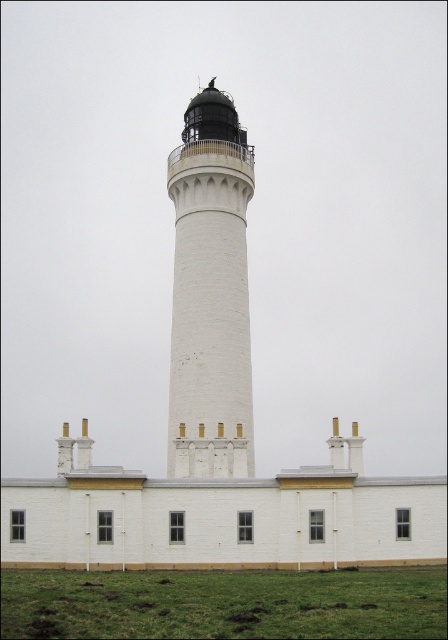
You are standing in front of the lighthouse and want to take a photo. You notice two points marked on the wall at coordinates point (x=115, y=586) and point (x=190, y=204). Which point is closer to your camera lens when taking the photo?

Point (x=115, y=586) is closer to the camera than point (x=190, y=204).